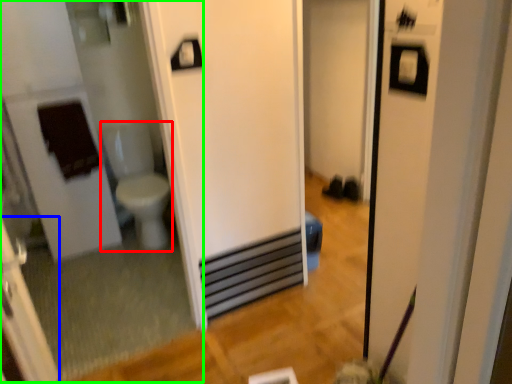
Question: Which object is positioned closest to toilet bowl (highlighted by a red box)? Select from screen door (highlighted by a blue box) and mirror (highlighted by a green box).

Choices:
 (A) screen door
 (B) mirror

Answer: (B)